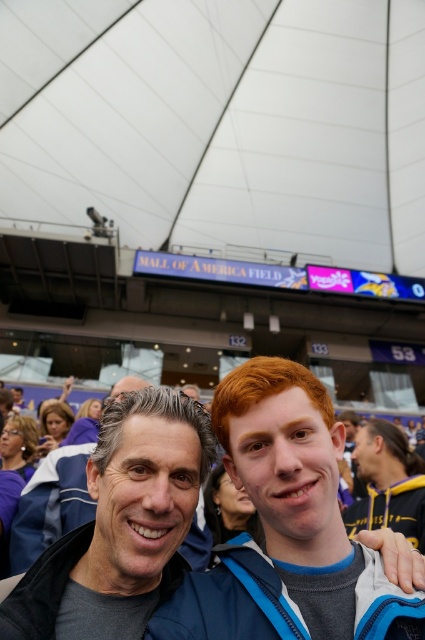
Question: Which of the following is the farthest from the observer?

Choices:
 (A) matte blue jacket at center
 (B) dark blue jacket at center

Answer: (B)

Question: Which of the following is the farthest from the observer?

Choices:
 (A) matte blue jacket at center
 (B) dark blue jacket at center

Answer: (B)

Question: Is matte blue jacket at center below dark blue jacket at center?

Choices:
 (A) yes
 (B) no

Answer: (B)

Question: Is matte blue jacket at center further to camera compared to dark blue jacket at center?

Choices:
 (A) yes
 (B) no

Answer: (B)

Question: Can you confirm if matte blue jacket at center is bigger than dark blue jacket at center?

Choices:
 (A) yes
 (B) no

Answer: (A)